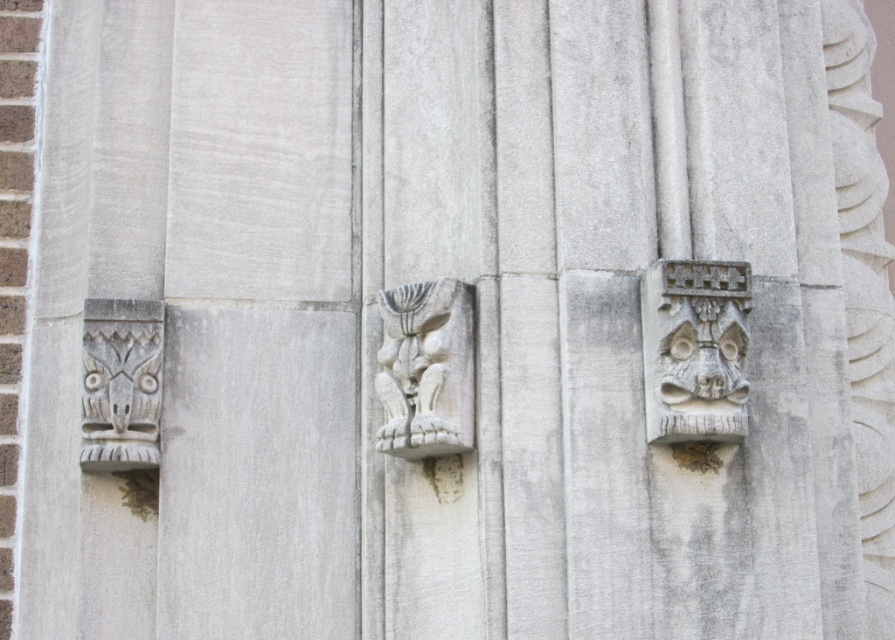
You are standing in front of the building and notice two carvings on the wall. Which one is nearer to you, the white stone mask at right or the white stone carving at center?

The white stone mask at right is closer to the viewer than the white stone carving at center, so the white stone mask at right is nearer to you.

Based on the coordinates provided in the description, where is the white stone carving at center located in the image?

The white stone carving at center is located at the coordinates point [425,369] in the image.